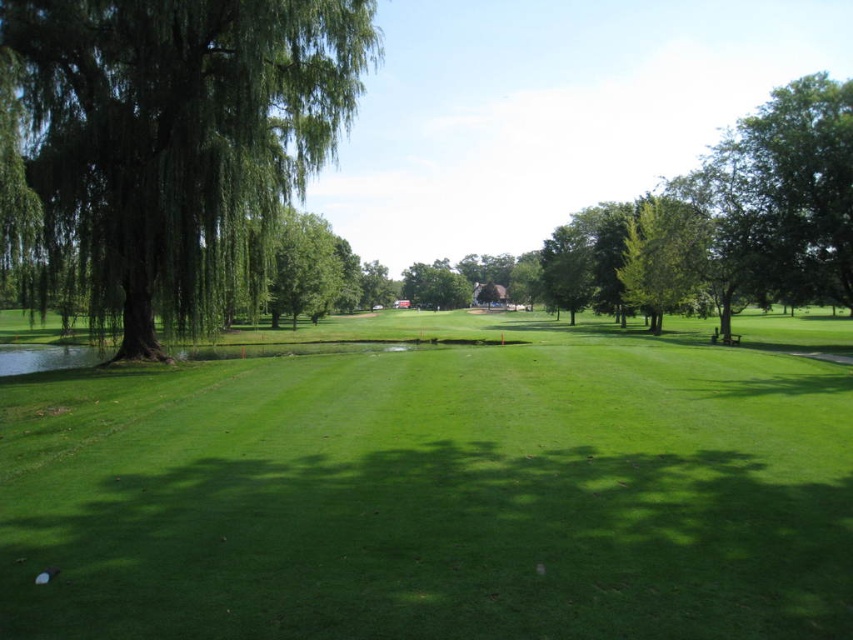
Question: In this image, where is green grassy field at center located relative to green leafy tree at left?

Choices:
 (A) below
 (B) above

Answer: (A)

Question: Which of the following is the closest to the observer?

Choices:
 (A) green leafy tree at left
 (B) green grassy field at center

Answer: (B)

Question: Which of these objects is positioned farthest from the green leafy tree at left?

Choices:
 (A) green grassy field at center
 (B) green leafy tree at right

Answer: (B)

Question: Is green leafy tree at left wider than green leafy tree at right?

Choices:
 (A) no
 (B) yes

Answer: (B)

Question: Estimate the real-world distances between objects in this image. Which object is farther from the green grassy field at center?

Choices:
 (A) green leafy tree at left
 (B) green leafy tree at right

Answer: (B)

Question: Can you confirm if green leafy tree at left is positioned below green leafy tree at right?

Choices:
 (A) yes
 (B) no

Answer: (A)